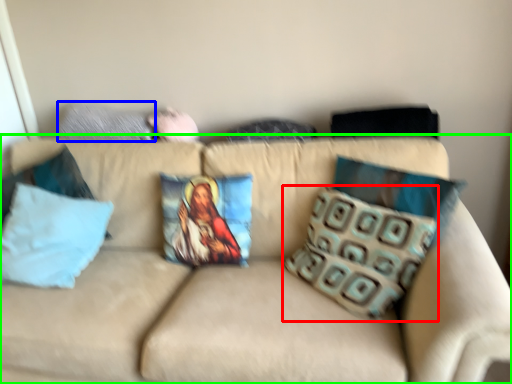
Question: Estimate the real-world distances between objects in this image. Which object is farther from pillow (highlighted by a red box), pillow (highlighted by a blue box) or studio couch (highlighted by a green box)?

Choices:
 (A) pillow
 (B) studio couch

Answer: (A)